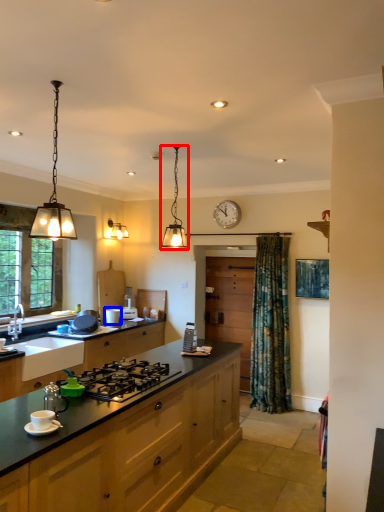
Question: Among these objects, which one is nearest to the camera, light fixture (highlighted by a red box) or appliance (highlighted by a blue box)?

Choices:
 (A) light fixture
 (B) appliance

Answer: (A)